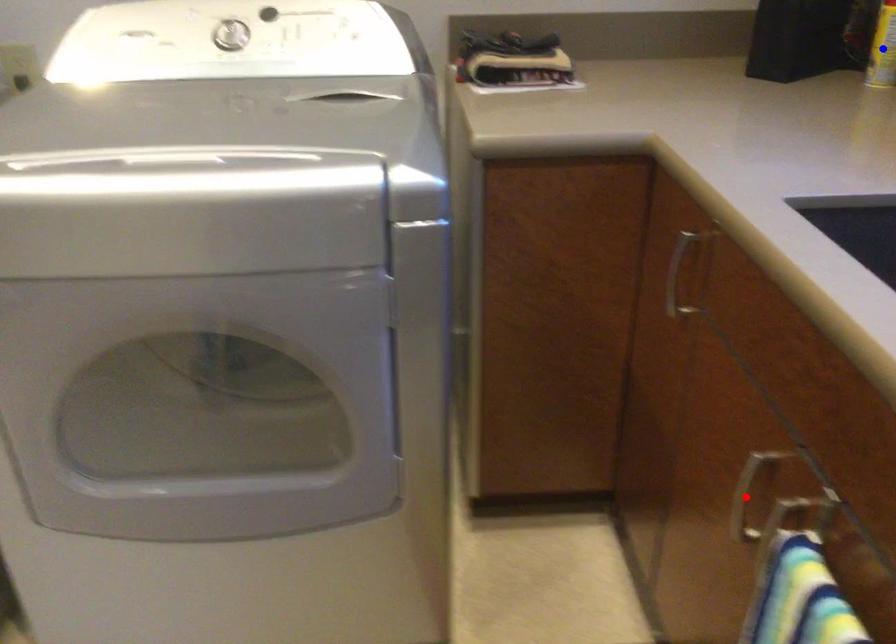
Question: Which of the two points in the image is closer to the camera?

Choices:
 (A) Blue point is closer.
 (B) Red point is closer.

Answer: (B)